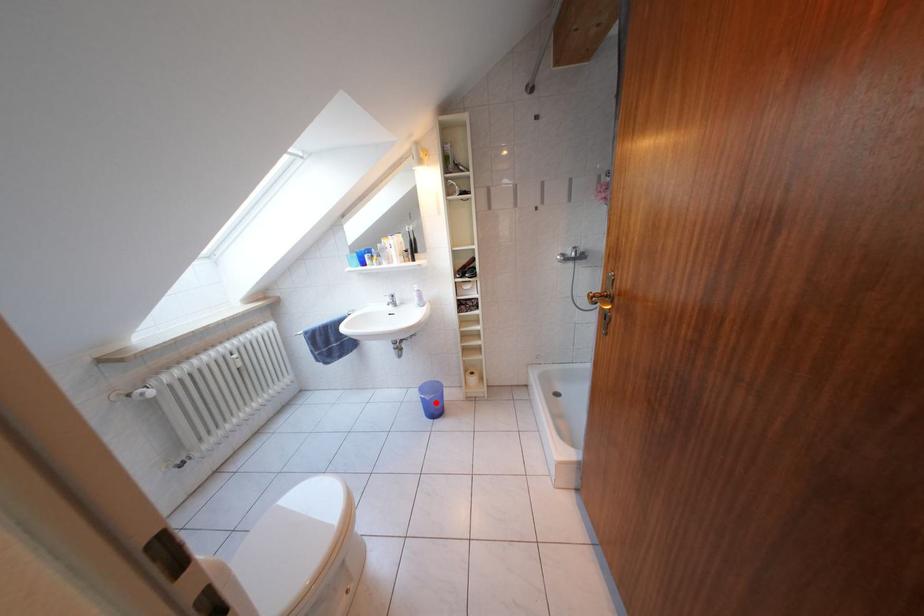
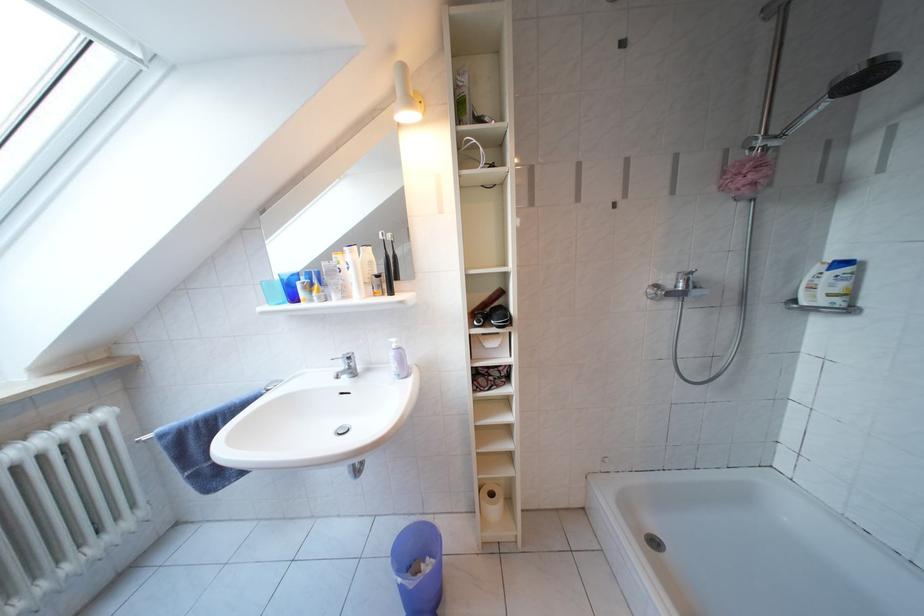
Locate, in the second image, the point that corresponds to the highlighted location in the first image.

(419, 589)